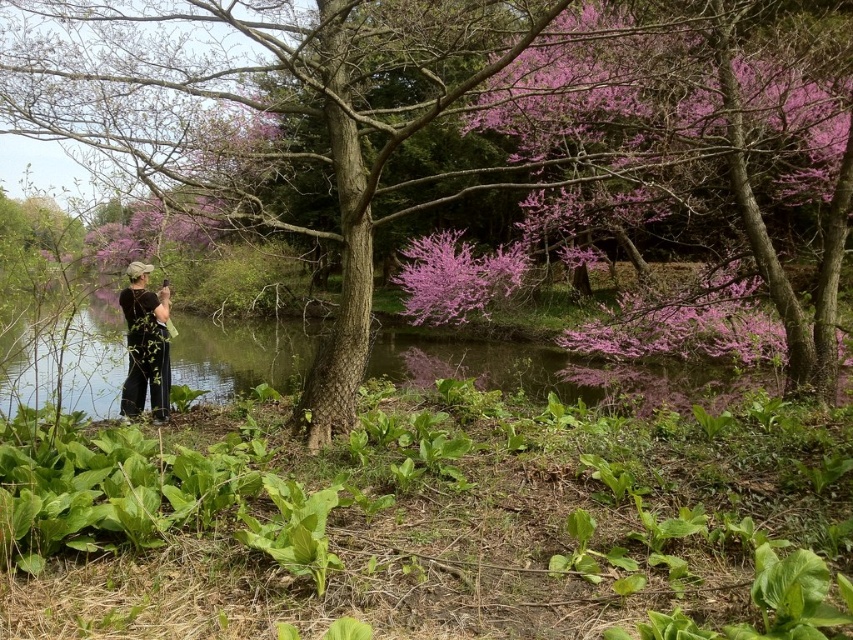
Between green leafy water at center and black cotton shirt at center, which one appears on the right side from the viewer's perspective?

From the viewer's perspective, green leafy water at center appears more on the right side.

How much distance is there between green leafy water at center and black cotton shirt at center?

The distance of green leafy water at center from black cotton shirt at center is 2.53 meters.

What do you see at coordinates (67, 358) in the screenshot? I see `green leafy water at center` at bounding box center [67, 358].

Image resolution: width=853 pixels, height=640 pixels. Find the location of `green leafy water at center`. green leafy water at center is located at coordinates point(67,358).

Does green leafy water at center lie in front of pink bloom at center?

Yes, green leafy water at center is in front of pink bloom at center.

The height and width of the screenshot is (640, 853). Describe the element at coordinates (67, 358) in the screenshot. I see `green leafy water at center` at that location.

Between point (543, 388) and point (392, 280), which one is positioned behind?

The point (392, 280) is more distant.

The image size is (853, 640). In order to click on green leafy water at center in this screenshot , I will do `click(67, 358)`.

Can you confirm if smooth bark tree at center is smaller than green leafy water at center?

Incorrect, smooth bark tree at center is not smaller in size than green leafy water at center.

Does smooth bark tree at center appear on the right side of green leafy water at center?

Indeed, smooth bark tree at center is positioned on the right side of green leafy water at center.

Who is more distant from viewer, (x=206, y=52) or (x=286, y=348)?

The point (x=286, y=348) is more distant.

The image size is (853, 640). I want to click on smooth bark tree at center, so click(x=389, y=120).